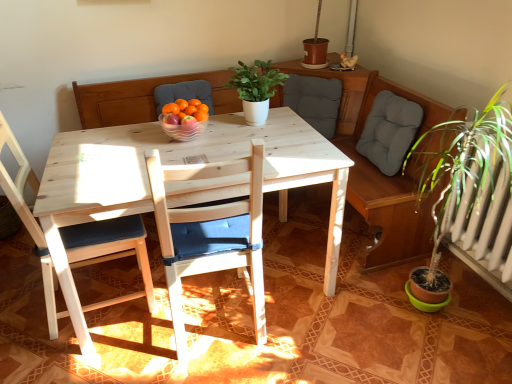
Image resolution: width=512 pixels, height=384 pixels. What do you see at coordinates (110, 250) in the screenshot?
I see `wooden chair with blue cushion at left, which is counted as the 2th chair, starting from the right` at bounding box center [110, 250].

The width and height of the screenshot is (512, 384). I want to click on wooden chair with blue cushion at center, the second chair from the left, so click(210, 233).

This screenshot has height=384, width=512. Find the location of `gray fabric cushion at upper center`. gray fabric cushion at upper center is located at coordinates coord(314,101).

Find the location of a particular element. This screenshot has height=384, width=512. wooden chair with blue cushion at left, which is the 1th chair from left to right is located at coordinates (110, 250).

Between wooden chair with blue cushion at left, which is counted as the 2th chair, starting from the right, and clear glass bowl at center, which one has smaller size?

With smaller size is clear glass bowl at center.

Is point (140, 245) closer or farther from the camera than point (198, 125)?

Clearly, point (140, 245) is closer to the camera than point (198, 125).

Is wooden chair with blue cushion at left, which is counted as the 2th chair, starting from the right, far from clear glass bowl at center?

They are positioned close to each other.

Between wooden chair with blue cushion at left, which is counted as the 2th chair, starting from the right, and clear glass bowl at center, which one has less height?

clear glass bowl at center.

Consider the image. Could you tell me if wooden chair with blue cushion at left, which is the 1th chair from left to right, is turned towards green matte plant at center?

Yes, wooden chair with blue cushion at left, which is the 1th chair from left to right, is turned towards green matte plant at center.

Are wooden chair with blue cushion at left, which is the 1th chair from left to right, and green matte plant at center making contact?

No, wooden chair with blue cushion at left, which is the 1th chair from left to right, is not next to green matte plant at center.

In the image, is wooden chair with blue cushion at left, which is the 1th chair from left to right, positioned in front of or behind green matte plant at center?

wooden chair with blue cushion at left, which is the 1th chair from left to right, is positioned closer to the viewer than green matte plant at center.

In the scene shown: Can you tell me how much wooden chair with blue cushion at left, which is counted as the 2th chair, starting from the right, and green matte plant at center differ in facing direction?

94.2 degrees separate the facing orientations of wooden chair with blue cushion at left, which is counted as the 2th chair, starting from the right, and green matte plant at center.

Identify the location of glass bowl on the left of green matte plant at center. (182, 129).

In the scene shown: Which object is further away from the camera, clear glass bowl at center or green matte plant at center?

green matte plant at center is more distant.

Is clear glass bowl at center outside of green matte plant at center?

Yes, clear glass bowl at center is outside of green matte plant at center.

Which point is more distant from viewer, (x=184, y=126) or (x=258, y=80)?

Positioned behind is point (x=258, y=80).

Can you confirm if wooden chair with blue cushion at center, which is the 1th chair from right to left, is positioned to the left of wooden chair with blue cushion at left, which is the 1th chair from left to right?

No.

From the picture: Does wooden chair with blue cushion at center, which is the 1th chair from right to left, have a smaller size compared to wooden chair with blue cushion at left, which is counted as the 2th chair, starting from the right?

Actually, wooden chair with blue cushion at center, which is the 1th chair from right to left, might be larger than wooden chair with blue cushion at left, which is counted as the 2th chair, starting from the right.

Is wooden chair with blue cushion at center, the second chair from the left, taller or shorter than wooden chair with blue cushion at left, which is counted as the 2th chair, starting from the right?

In the image, wooden chair with blue cushion at center, the second chair from the left, appears to be shorter than wooden chair with blue cushion at left, which is counted as the 2th chair, starting from the right.

Does wooden chair with blue cushion at center, which is the 1th chair from right to left, turn towards wooden chair with blue cushion at left, which is the 1th chair from left to right?

No, wooden chair with blue cushion at center, which is the 1th chair from right to left, is not facing towards wooden chair with blue cushion at left, which is the 1th chair from left to right.

Can you tell me how much green matte plant at center and gray fabric cushion at upper center differ in facing direction?

The facing directions of green matte plant at center and gray fabric cushion at upper center are 45.6 degrees apart.

Would you say green matte plant at center is outside gray fabric cushion at upper center?

Absolutely, green matte plant at center is external to gray fabric cushion at upper center.

Which of these two, green matte plant at center or gray fabric cushion at upper center, is wider?

green matte plant at center is wider.

From the image's perspective, which object appears higher, green matte plant at center or gray fabric cushion at upper center?

gray fabric cushion at upper center is shown above in the image.

Does clear glass bowl at center have a greater height compared to wooden chair with blue cushion at left, which is counted as the 2th chair, starting from the right?

No.

Locate an element on the screen. This screenshot has height=384, width=512. glass bowl above the wooden chair with blue cushion at left, which is counted as the 2th chair, starting from the right (from the image's perspective) is located at coordinates (182, 129).

Is clear glass bowl at center positioned behind wooden chair with blue cushion at left, which is counted as the 2th chair, starting from the right?

Yes, the depth of clear glass bowl at center is greater than that of wooden chair with blue cushion at left, which is counted as the 2th chair, starting from the right.

Does clear glass bowl at center have a lesser width compared to wooden chair with blue cushion at left, which is the 1th chair from left to right?

Yes, clear glass bowl at center is thinner than wooden chair with blue cushion at left, which is the 1th chair from left to right.

Considering the sizes of green matte plant at center and wooden chair with blue cushion at center, which is the 1th chair from right to left, in the image, is green matte plant at center wider or thinner than wooden chair with blue cushion at center, which is the 1th chair from right to left,?

Considering their sizes, green matte plant at center looks slimmer than wooden chair with blue cushion at center, which is the 1th chair from right to left.

The width and height of the screenshot is (512, 384). I want to click on chair that is the 1st one when counting leftward from the green matte plant at center, so click(x=210, y=233).

Choose the correct answer: Is green matte plant at center inside wooden chair with blue cushion at center, which is the 1th chair from right to left, or outside it?

green matte plant at center exists outside the volume of wooden chair with blue cushion at center, which is the 1th chair from right to left.

Which of these two, green matte plant at center or wooden chair with blue cushion at center, the second chair from the left, is smaller?

With smaller size is green matte plant at center.

Locate an element on the screen. Image resolution: width=512 pixels, height=384 pixels. chair to the left of clear glass bowl at center is located at coordinates (110, 250).

In order to click on the 2nd chair below the green matte plant at center (from a real-world perspective) in this screenshot , I will do 110,250.

When comparing their distances from wooden chair with blue cushion at left, which is counted as the 2th chair, starting from the right, does wooden chair with blue cushion at center, which is the 1th chair from right to left, or gray fabric cushion at upper center seem further?

gray fabric cushion at upper center lies further to wooden chair with blue cushion at left, which is counted as the 2th chair, starting from the right, than the other object.

From the image, which object appears to be nearer to wooden chair with blue cushion at center, the second chair from the left, green matte plant at center or clear glass bowl at center?

clear glass bowl at center is positioned closer to the anchor wooden chair with blue cushion at center, the second chair from the left.

When comparing their distances from gray fabric cushion at upper center, does clear glass bowl at center or wooden chair with blue cushion at center, the second chair from the left, seem closer?

clear glass bowl at center.

Estimate the real-world distances between objects in this image. Which object is further from green matte plant at center, wooden chair with blue cushion at center, which is the 1th chair from right to left, or gray fabric cushion at upper center?

The object further to green matte plant at center is wooden chair with blue cushion at center, which is the 1th chair from right to left.

Based on their spatial positions, is wooden chair with blue cushion at center, the second chair from the left, or wooden chair with blue cushion at left, which is counted as the 2th chair, starting from the right, closer to green matte plant at center?

wooden chair with blue cushion at center, the second chair from the left, is closer to green matte plant at center.

In the scene shown: Which object lies further to the anchor point green matte plant at center, wooden chair with blue cushion at left, which is the 1th chair from left to right, or gray fabric cushion at upper center?

wooden chair with blue cushion at left, which is the 1th chair from left to right, is positioned further to the anchor green matte plant at center.

When comparing their distances from wooden chair with blue cushion at left, which is the 1th chair from left to right, does clear glass bowl at center or wooden chair with blue cushion at center, the second chair from the left, seem further?

The object further to wooden chair with blue cushion at left, which is the 1th chair from left to right, is clear glass bowl at center.

Which object lies further to the anchor point gray fabric cushion at upper center, wooden chair with blue cushion at left, which is counted as the 2th chair, starting from the right, or clear glass bowl at center?

wooden chair with blue cushion at left, which is counted as the 2th chair, starting from the right.

This screenshot has width=512, height=384. I want to click on houseplant positioned between wooden chair with blue cushion at center, the second chair from the left, and gray fabric cushion at upper center from near to far, so tap(256, 88).

At what (x,y) coordinates should I click in order to perform the action: click on glass bowl between wooden chair with blue cushion at left, which is the 1th chair from left to right, and gray fabric cushion at upper center from left to right. Please return your answer as a coordinate pair (x, y). The height and width of the screenshot is (384, 512). Looking at the image, I should click on (182, 129).

Where is `chair located between wooden chair with blue cushion at center, the second chair from the left, and gray fabric cushion at upper center in the depth direction`? The image size is (512, 384). chair located between wooden chair with blue cushion at center, the second chair from the left, and gray fabric cushion at upper center in the depth direction is located at coordinates (110, 250).

Locate an element on the screen. The width and height of the screenshot is (512, 384). glass bowl between wooden chair with blue cushion at left, which is counted as the 2th chair, starting from the right, and green matte plant at center from left to right is located at coordinates (182, 129).